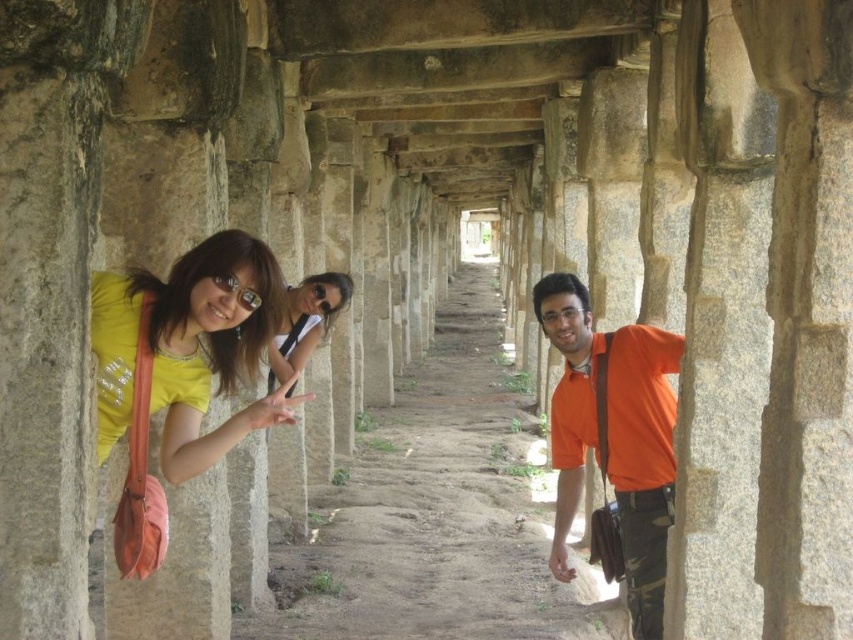
Question: Considering the real-world distances, which object is closest to the orange cotton shirt at center?

Choices:
 (A) sunglasses at center
 (B) yellow fabric bag at left

Answer: (B)

Question: Can you confirm if yellow fabric bag at left is smaller than orange cotton shirt at center?

Choices:
 (A) yes
 (B) no

Answer: (B)

Question: Which point is closer to the camera?

Choices:
 (A) orange cotton shirt at center
 (B) yellow fabric bag at left

Answer: (B)

Question: From the image, what is the correct spatial relationship of yellow fabric bag at left in relation to sunglasses at center?

Choices:
 (A) right
 (B) left

Answer: (A)

Question: Is yellow fabric bag at left smaller than sunglasses at center?

Choices:
 (A) no
 (B) yes

Answer: (A)

Question: Which point is farther to the camera?

Choices:
 (A) yellow fabric bag at left
 (B) orange cotton shirt at center

Answer: (B)